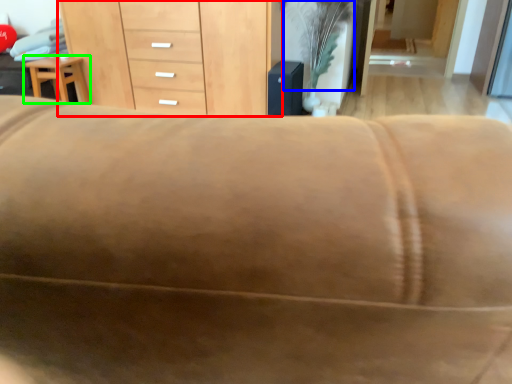
Question: Which object is the closest to the chest of drawers (highlighted by a red box)? Choose among these: plant (highlighted by a blue box) or furniture (highlighted by a green box).

Choices:
 (A) plant
 (B) furniture

Answer: (B)